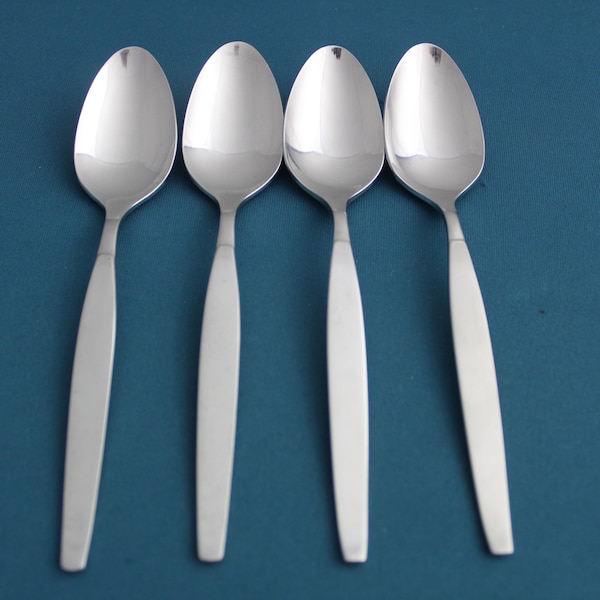
Where is `spoon`? The width and height of the screenshot is (600, 600). spoon is located at coordinates (425, 174), (303, 119), (259, 124), (124, 133).